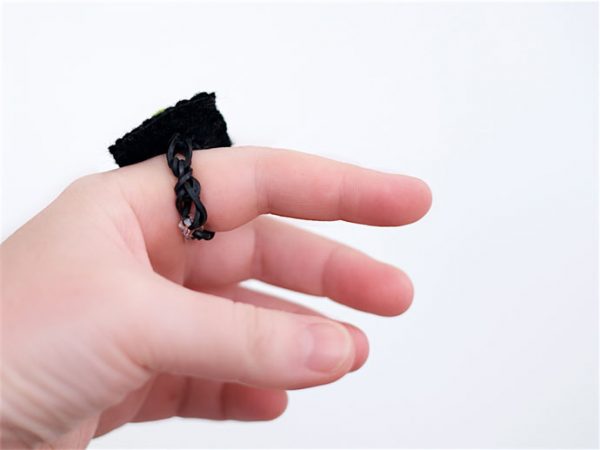
Where is `black cord`? This screenshot has height=450, width=600. black cord is located at coordinates (188, 191).